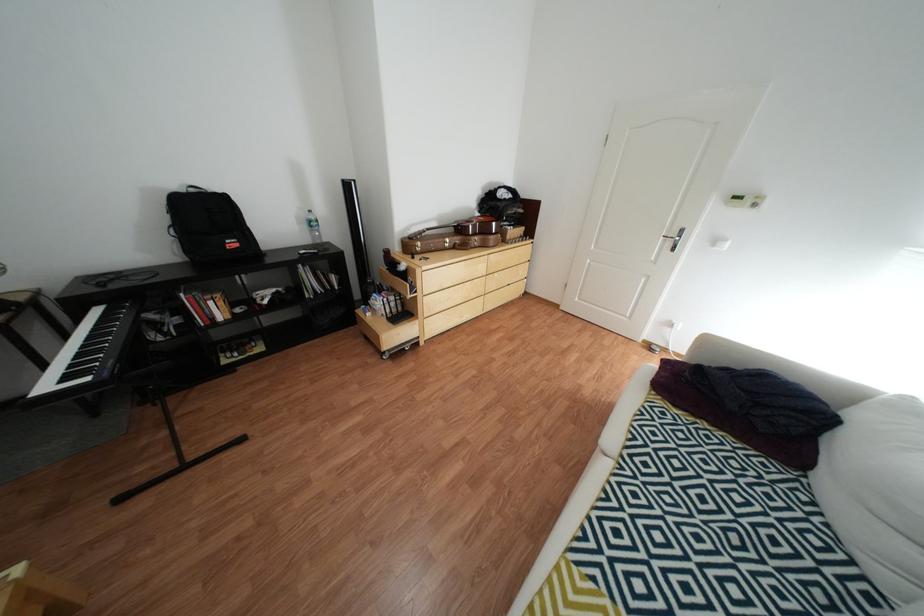
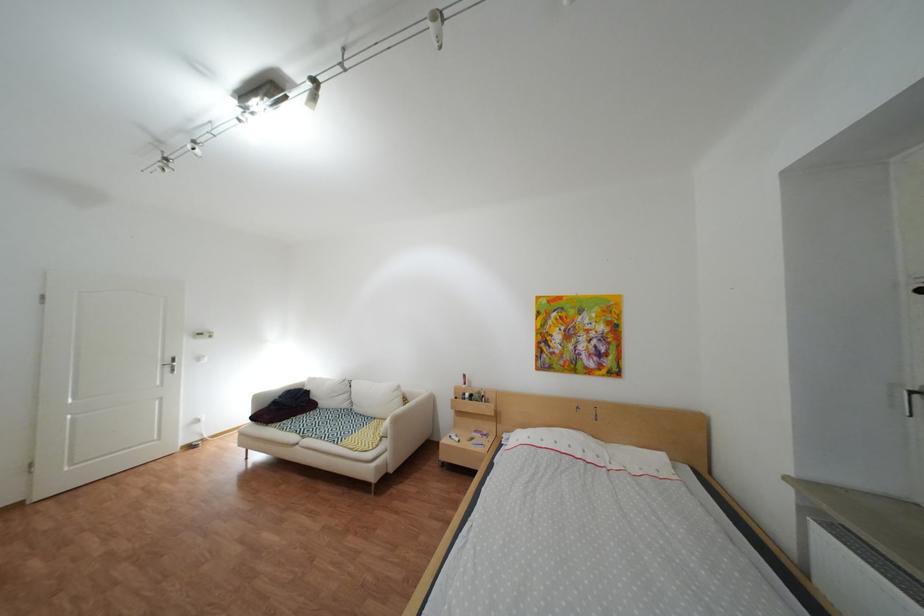
Find the pixel in the second image that matches (676,403) in the first image.

(294, 424)